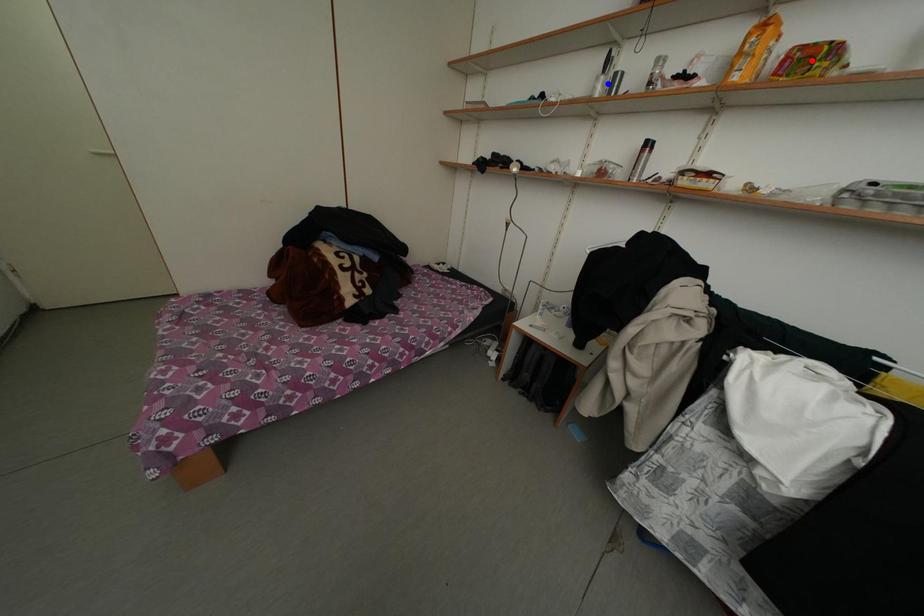
Question: Which of the two points in the image is closer to the camera?

Choices:
 (A) Blue point is closer.
 (B) Red point is closer.

Answer: (B)